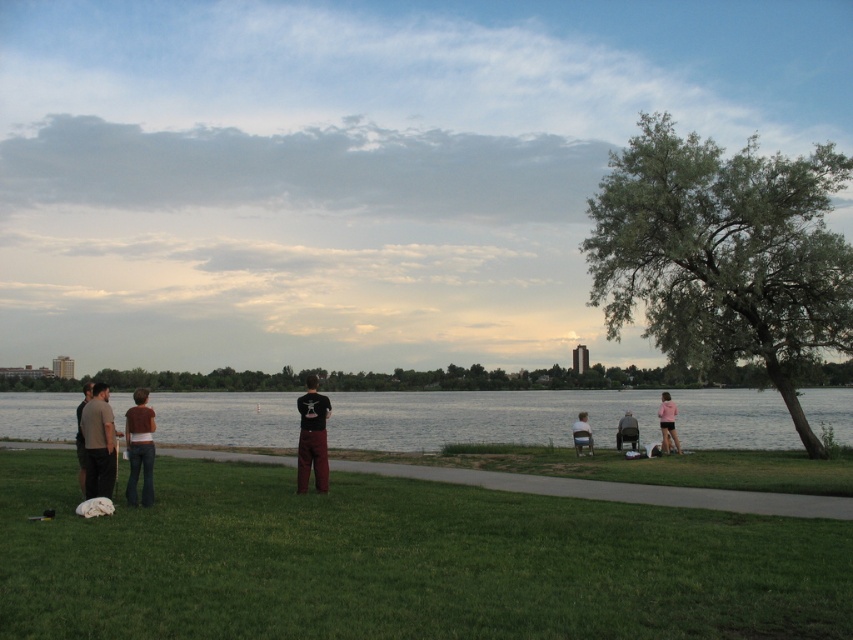
You are standing at the lakeside and want to take a photo of both point (416, 506) and point (136, 412) in the scene. Which point should you focus on first to ensure both are in clear view?

You should focus on point (416, 506) first because it is closer to the camera than point (136, 412). This ensures that both points will be in focus when using a camera with a fixed focal length.

You are standing at the point labeled point (107, 484) and want to walk towards the point labeled point (579, 436). Which direction should you move relative to the camera?

You should move towards the upper right direction relative to the camera because point (579, 436) is located at a higher vertical position and to the right of point (107, 484).

You are standing at the edge of the lake and want to throw a frisbee to a friend. You see the dark gray pants at lower left and the black matte shirt at center. Which direction should you aim to reach the person closer to you?

The dark gray pants at lower left is closer to you than the black matte shirt at center, so aim towards the dark gray pants at lower left.